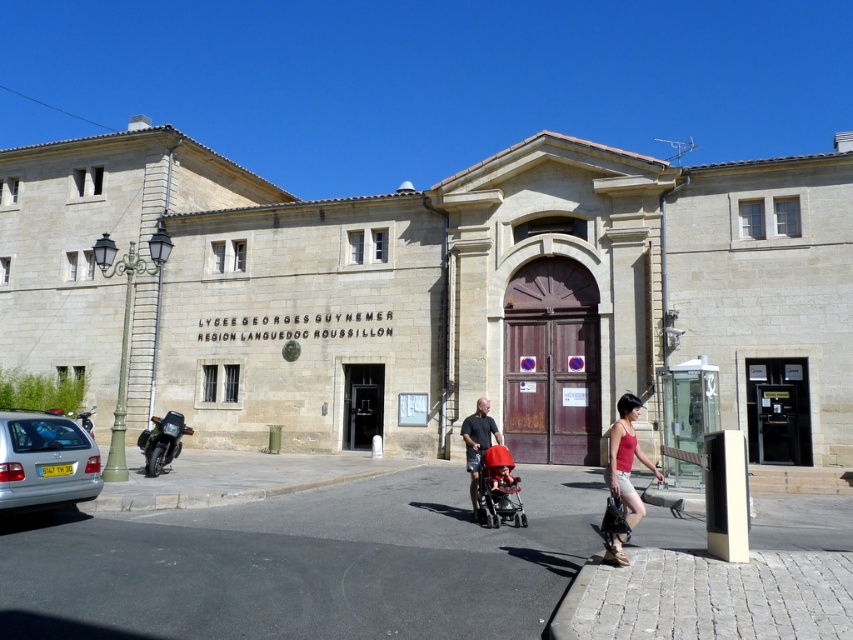
You are a pedestrian standing on the paved area in front of the school. You see the red plastic baby carriage at center and the shiny black motorcycle at lower left. Which object is closer to you?

The red plastic baby carriage at center is closer to you because it is positioned over the shiny black motorcycle at lower left, indicating it is in front of the motorcycle.

In the scene shown: You are a photographer standing in front of the Lyc?e Georges Guynemer building. You notice the matte red tank top at center and the shiny black motorcycle at lower left. Which object is wider?

The shiny black motorcycle at lower left is wider than the matte red tank top at center.